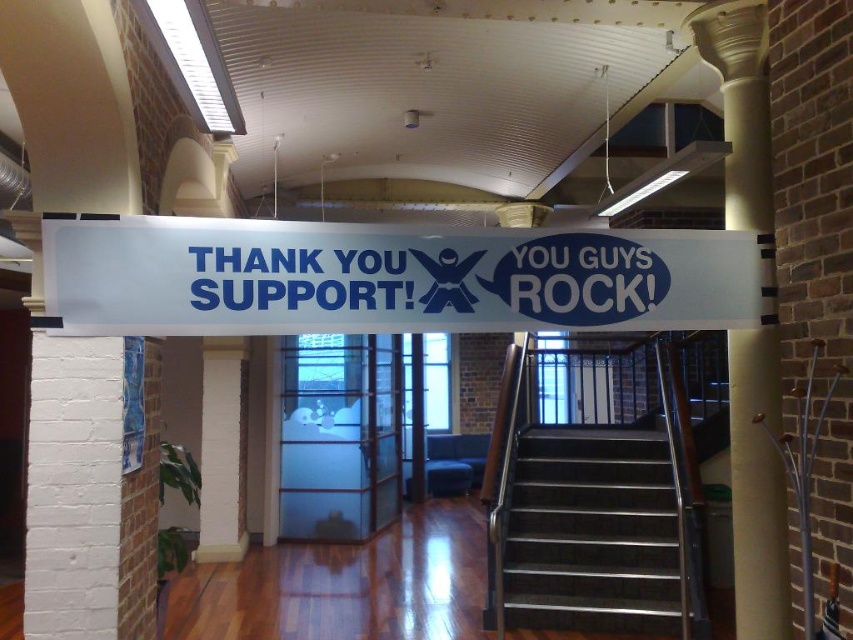
Can you confirm if white smooth column at center is positioned above white textured pillar at lower left?

Correct, white smooth column at center is located above white textured pillar at lower left.

From the picture: Is white smooth column at center thinner than white textured pillar at lower left?

Correct, white smooth column at center's width is less than white textured pillar at lower left's.

Does point (751, 369) come behind point (202, 442)?

No, it is not.

The height and width of the screenshot is (640, 853). I want to click on white smooth column at center, so click(757, 486).

Is white painted brick pillar at left to the left of transparent glass door at center from the viewer's perspective?

Indeed, white painted brick pillar at left is positioned on the left side of transparent glass door at center.

At what (x,y) coordinates should I click in order to perform the action: click on white painted brick pillar at left. Please return your answer as a coordinate pair (x, y). This screenshot has width=853, height=640. Looking at the image, I should click on (73, 488).

Is point (102, 456) less distant than point (318, 481)?

Yes, point (102, 456) is closer to viewer.

The width and height of the screenshot is (853, 640). I want to click on white painted brick pillar at left, so click(x=73, y=488).

Is point (117, 300) farther from viewer compared to point (41, 502)?

Yes, point (117, 300) is farther from viewer.

Between white plastic banner at center and white painted brick pillar at left, which one appears on the right side from the viewer's perspective?

From the viewer's perspective, white plastic banner at center appears more on the right side.

Is point (303, 253) closer to camera compared to point (74, 566)?

No, (303, 253) is behind (74, 566).

Where is `white plastic banner at center`? The height and width of the screenshot is (640, 853). white plastic banner at center is located at coordinates (392, 276).